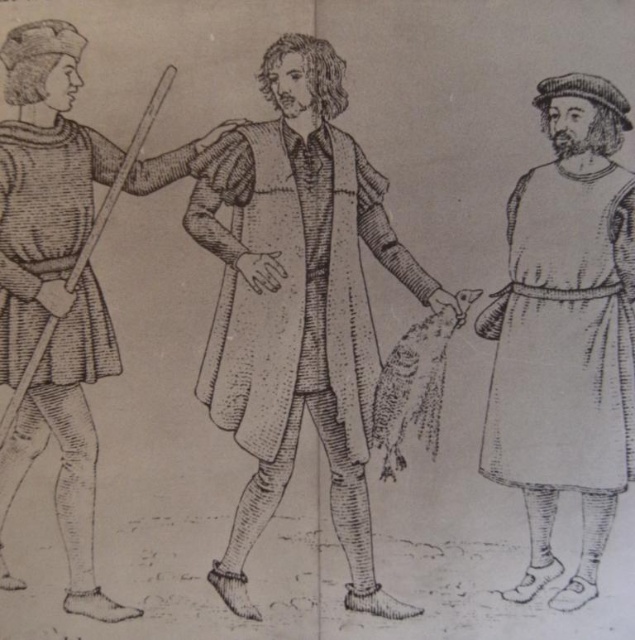
Question: Which point is farther to the camera?

Choices:
 (A) (542, 275)
 (B) (237, 397)
 (C) (58, 504)

Answer: (B)

Question: Which is nearer to the smooth beige tunic at right?

Choices:
 (A) smooth brown robe at center
 (B) smooth brown coat at center

Answer: (B)

Question: In this image, where is smooth beige tunic at right located relative to smooth brown robe at center?

Choices:
 (A) below
 (B) above

Answer: (A)

Question: Does smooth beige tunic at right appear on the right side of smooth brown robe at center?

Choices:
 (A) no
 (B) yes

Answer: (B)

Question: From the image, what is the correct spatial relationship of smooth brown coat at center in relation to smooth beige tunic at right?

Choices:
 (A) above
 (B) below

Answer: (A)

Question: Which is nearer to the smooth brown robe at center?

Choices:
 (A) smooth brown coat at center
 (B) smooth beige tunic at right

Answer: (A)